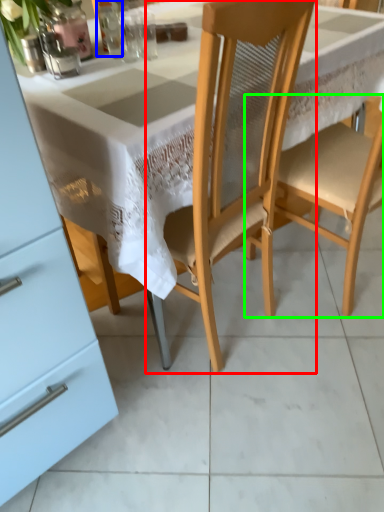
Question: Which object is positioned closest to chair (highlighted by a red box)? Select from tableware (highlighted by a blue box) and chair (highlighted by a green box).

Choices:
 (A) tableware
 (B) chair

Answer: (B)